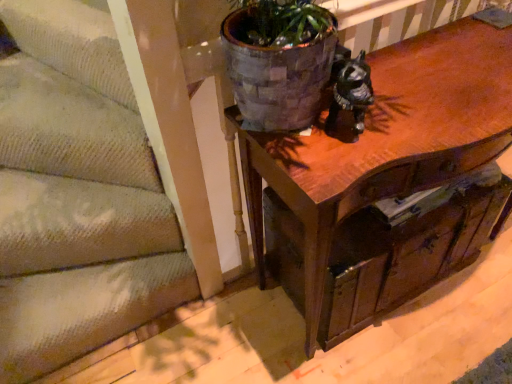
At what (x,y) coordinates should I click in order to perform the action: click on wooden table at center. Please return your answer as a coordinate pair (x, y). The width and height of the screenshot is (512, 384). Looking at the image, I should click on (388, 142).

Describe the element at coordinates (77, 195) in the screenshot. The width and height of the screenshot is (512, 384). I see `textured beige carpet at lower left` at that location.

Locate an element on the screen. The width and height of the screenshot is (512, 384). wooden drawer at center is located at coordinates (407, 249).

Locate an element on the screen. Image resolution: width=512 pixels, height=384 pixels. wooden table at center is located at coordinates (388, 142).

Does wooden drawer at center have a larger size compared to wooden table at center?

Incorrect, wooden drawer at center is not larger than wooden table at center.

Based on the photo, how many degrees apart are the facing directions of wooden drawer at center and wooden table at center?

They differ by 2.15 degrees in their facing directions.

Is wooden drawer at center oriented towards wooden table at center?

Yes, wooden drawer at center is facing wooden table at center.

The width and height of the screenshot is (512, 384). What are the coordinates of `drawer located underneath the wooden table at center (from a real-world perspective)` in the screenshot? It's located at (407, 249).

Is textured beige carpet at lower left aimed at wooden table at center?

No, textured beige carpet at lower left is not aimed at wooden table at center.

From the picture: Which of these two, textured beige carpet at lower left or wooden table at center, is wider?

With larger width is textured beige carpet at lower left.

Is wooden table at center surrounded by textured beige carpet at lower left?

→ No, textured beige carpet at lower left does not contain wooden table at center.

From the image's perspective, is textured beige carpet at lower left below wooden table at center?

Correct, textured beige carpet at lower left appears lower than wooden table at center in the image.

From the image's perspective, is wooden table at center on top of textured beige carpet at lower left?

Indeed, from the image's perspective, wooden table at center is shown above textured beige carpet at lower left.

Which is more to the left, wooden table at center or textured beige carpet at lower left?

Positioned to the left is textured beige carpet at lower left.

Are wooden table at center and textured beige carpet at lower left located far from each other?

They are positioned close to each other.

Is textured beige carpet at lower left at the back of wooden table at center?

No, wooden table at center is not facing the opposite direction of textured beige carpet at lower left.

Is wooden table at center inside the boundaries of wooden drawer at center, or outside?

wooden table at center is spatially positioned inside wooden drawer at center.

Considering the relative sizes of wooden table at center and wooden drawer at center in the image provided, is wooden table at center shorter than wooden drawer at center?

No, wooden table at center is not shorter than wooden drawer at center.

Identify the location of drawer behind the wooden table at center. Image resolution: width=512 pixels, height=384 pixels. (407, 249).

From the image's perspective, who appears lower, wooden table at center or wooden drawer at center?

From the image's view, wooden drawer at center is below.

Consider the image. Is wooden drawer at center oriented towards textured beige carpet at lower left?

No, wooden drawer at center is not turned towards textured beige carpet at lower left.

Is wooden drawer at center further to camera compared to textured beige carpet at lower left?

No, wooden drawer at center is in front of textured beige carpet at lower left.

Is wooden drawer at center in contact with textured beige carpet at lower left?

No, wooden drawer at center is not in contact with textured beige carpet at lower left.

From a real-world perspective, is wooden drawer at center located higher than textured beige carpet at lower left?

Yes, from a real-world perspective, wooden drawer at center is over textured beige carpet at lower left

Which object is wider, textured beige carpet at lower left or wooden drawer at center?

textured beige carpet at lower left is wider.

Is textured beige carpet at lower left aimed at wooden drawer at center?

No, textured beige carpet at lower left is not turned towards wooden drawer at center.

Locate an element on the screen. stairwell below the wooden drawer at center (from a real-world perspective) is located at coordinates (77, 195).

Which object is positioned more to the right, textured beige carpet at lower left or wooden drawer at center?

wooden drawer at center.

Identify the location of drawer on the left of wooden table at center. The width and height of the screenshot is (512, 384). (407, 249).

At what (x,y) coordinates should I click in order to perform the action: click on table positioned vertically above the textured beige carpet at lower left (from a real-world perspective). Please return your answer as a coordinate pair (x, y). Looking at the image, I should click on (388, 142).

When comparing their distances from wooden drawer at center, does textured beige carpet at lower left or wooden table at center seem closer?

Based on the image, wooden table at center appears to be nearer to wooden drawer at center.

Estimate the real-world distances between objects in this image. Which object is closer to wooden table at center, textured beige carpet at lower left or wooden drawer at center?

Based on the image, wooden drawer at center appears to be nearer to wooden table at center.

Considering their positions, is wooden drawer at center positioned further to textured beige carpet at lower left than wooden table at center?

wooden drawer at center.

Estimate the real-world distances between objects in this image. Which object is further from wooden table at center, wooden drawer at center or textured beige carpet at lower left?

Based on the image, textured beige carpet at lower left appears to be further to wooden table at center.

Based on their spatial positions, is wooden table at center or wooden drawer at center further from textured beige carpet at lower left?

wooden drawer at center is further to textured beige carpet at lower left.

Considering their positions, is wooden table at center positioned closer to wooden drawer at center than textured beige carpet at lower left?

The object closer to wooden drawer at center is wooden table at center.

Where is `drawer between textured beige carpet at lower left and wooden table at center`? drawer between textured beige carpet at lower left and wooden table at center is located at coordinates (407, 249).